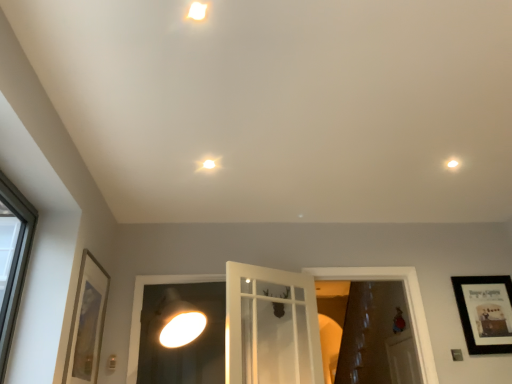
Question: Which direction should I rotate to face white glossy door at center, placed as the second window frame when sorted from left to right, — up or down?

Choices:
 (A) up
 (B) down

Answer: (B)

Question: Is white glass door at center, the first window frame in the left-to-right sequence, at the left side of matte white droplight at center, placed as the first droplight when sorted from left to right?

Choices:
 (A) no
 (B) yes

Answer: (B)

Question: From a real-world perspective, is white glass door at center, the first window frame in the left-to-right sequence, located higher than matte white droplight at center, which appears as the third droplight when viewed from the top?

Choices:
 (A) yes
 (B) no

Answer: (B)

Question: Is white glass door at center, positioned as the second window frame in right-to-left order, bigger than matte white droplight at center, marked as the 2th droplight in a back-to-front arrangement?

Choices:
 (A) yes
 (B) no

Answer: (A)

Question: Is white glass door at center, the first window frame in the left-to-right sequence, next to matte white droplight at center, marked as the 2th droplight in a back-to-front arrangement?

Choices:
 (A) yes
 (B) no

Answer: (B)

Question: Is matte white droplight at center, placed as the 1th droplight when sorted from bottom to top, surrounded by white glass door at center, positioned as the second window frame in right-to-left order?

Choices:
 (A) no
 (B) yes

Answer: (A)

Question: Is white glass door at center, positioned as the second window frame in right-to-left order, at the right side of matte white droplight at center, which appears as the second droplight when viewed from the front?

Choices:
 (A) no
 (B) yes

Answer: (A)

Question: From a real-world perspective, does white glossy droplight at upper right, marked as the 3th droplight in a front-to-back arrangement, stand above black matte picture frame at upper right, which is counted as the first picture frame, starting from the right?

Choices:
 (A) yes
 (B) no

Answer: (A)

Question: Can you confirm if white glossy droplight at upper right, which is counted as the second droplight, starting from the bottom, is taller than black matte picture frame at upper right, which is counted as the first picture frame, starting from the right?

Choices:
 (A) yes
 (B) no

Answer: (B)

Question: Is white glossy droplight at upper right, marked as the 3th droplight in a front-to-back arrangement, surrounding black matte picture frame at upper right, which is counted as the first picture frame, starting from the right?

Choices:
 (A) yes
 (B) no

Answer: (B)

Question: Does white glossy droplight at upper right, the 3th droplight viewed from the left, appear on the left side of black matte picture frame at upper right, the 1th picture frame positioned from the back?

Choices:
 (A) no
 (B) yes

Answer: (B)

Question: Does white glossy droplight at upper right, the 1th droplight viewed from the right, have a larger size compared to black matte picture frame at upper right, which is counted as the first picture frame, starting from the right?

Choices:
 (A) yes
 (B) no

Answer: (B)

Question: Is white glossy droplight at upper right, the 3th droplight viewed from the left, next to black matte picture frame at upper right, which is counted as the first picture frame, starting from the right, and touching it?

Choices:
 (A) no
 (B) yes

Answer: (A)

Question: Can you confirm if white glass door at center, the first window frame in the left-to-right sequence, is taller than white glossy droplight at upper right, the 1th droplight viewed from the right?

Choices:
 (A) no
 (B) yes

Answer: (B)